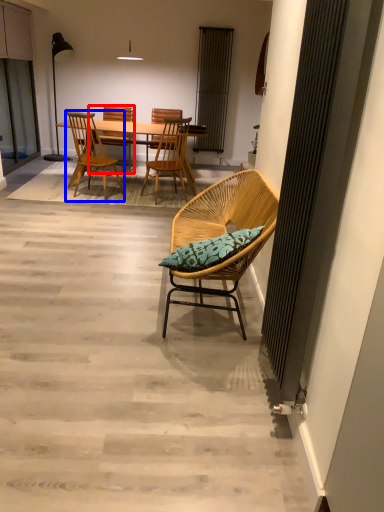
Question: Which point is closer to the camera, chair (highlighted by a red box) or chair (highlighted by a blue box)?

Choices:
 (A) chair
 (B) chair

Answer: (B)